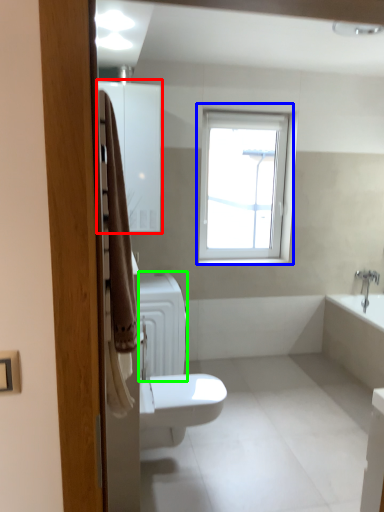
Question: Based on their relative distances, which object is farther from medicine cabinet (highlighted by a red box)? Choose from window (highlighted by a blue box) and radiator (highlighted by a green box).

Choices:
 (A) window
 (B) radiator

Answer: (A)